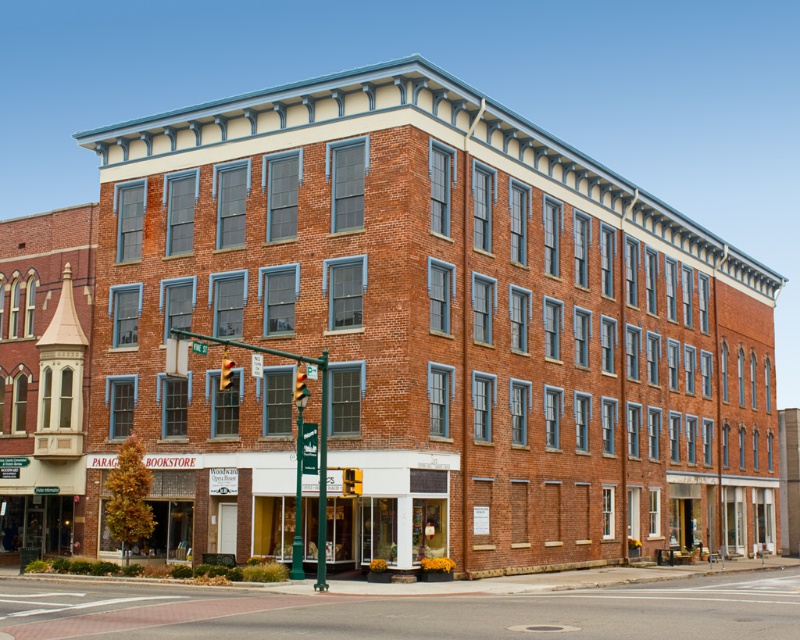
Question: Does smooth asphalt road at lower center appear over yellow plastic traffic light at center?

Choices:
 (A) no
 (B) yes

Answer: (A)

Question: Which point is farther to the camera?

Choices:
 (A) smooth asphalt road at lower center
 (B) yellow plastic traffic light at upper center
 (C) yellow plastic traffic light at center

Answer: (C)

Question: Can you confirm if yellow plastic traffic light at center is positioned to the left of yellow plastic traffic light at upper center?

Choices:
 (A) no
 (B) yes

Answer: (A)

Question: Which point is farther to the camera?

Choices:
 (A) (462, 616)
 (B) (352, 470)

Answer: (B)

Question: Which of the following is the closest to the observer?

Choices:
 (A) (320, 620)
 (B) (358, 481)
 (C) (225, 372)

Answer: (A)

Question: Is yellow plastic traffic light at center wider than red glass traffic light at center?

Choices:
 (A) no
 (B) yes

Answer: (B)